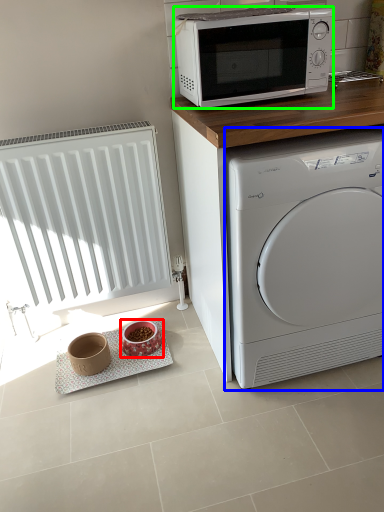
Question: Which object is positioned farthest from appliance (highlighted by a red box)? Select from washing machine (highlighted by a blue box) and microwave oven (highlighted by a green box).

Choices:
 (A) washing machine
 (B) microwave oven

Answer: (B)